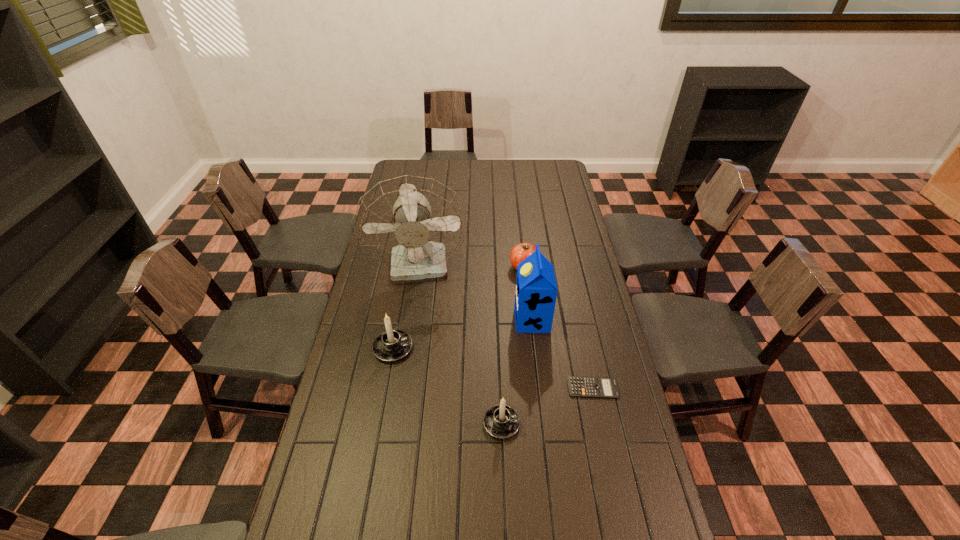
Where is `free space located with a handle on the side of the nearest object`? This screenshot has height=540, width=960. free space located with a handle on the side of the nearest object is located at coordinates (585, 423).

Locate an element on the screen. Image resolution: width=960 pixels, height=540 pixels. free spot located on the left of the second shortest object is located at coordinates (436, 267).

Find the location of a particular element. vacant area located 0.130m with the cap open on the fifth shortest object is located at coordinates (479, 320).

This screenshot has height=540, width=960. I want to click on vacant space located with the cap open on the fifth shortest object, so click(x=437, y=320).

Find the location of a particular element. This screenshot has height=540, width=960. free space located 0.250m with the cap open on the fifth shortest object is located at coordinates (445, 320).

Locate an element on the screen. vacant area situated 0.240m on the front of the rightmost object is located at coordinates (612, 478).

The image size is (960, 540). Find the location of `free space located in front of the tallest object to blow air`. free space located in front of the tallest object to blow air is located at coordinates (414, 322).

Locate an element on the screen. The width and height of the screenshot is (960, 540). candle holder situated at the left edge is located at coordinates (392, 345).

Find the location of a particular element. fan positioned at the left edge is located at coordinates (413, 224).

Image resolution: width=960 pixels, height=540 pixels. What are the coordinates of `object positioned at the right edge` in the screenshot? It's located at (596, 387).